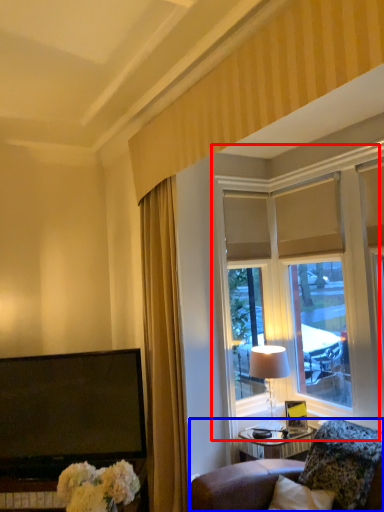
Question: Which of the following is the farthest to the observer, window (highlighted by a red box) or furniture (highlighted by a blue box)?

Choices:
 (A) window
 (B) furniture

Answer: (A)